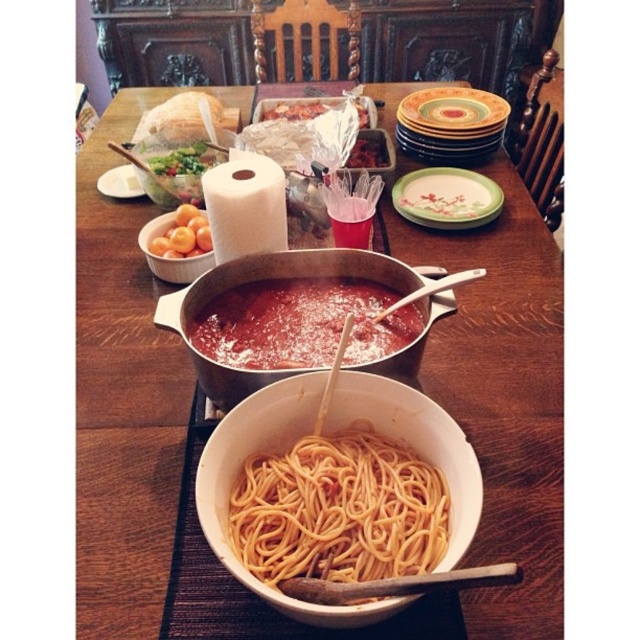
Can you confirm if white ceramic bowl at center is bigger than white matte bowl at center?

Yes, white ceramic bowl at center is bigger than white matte bowl at center.

Image resolution: width=640 pixels, height=640 pixels. Describe the element at coordinates (502, 397) in the screenshot. I see `white ceramic bowl at center` at that location.

This screenshot has width=640, height=640. I want to click on white ceramic bowl at center, so click(x=502, y=397).

Measure the distance between white matte bowl at center and smooth white bread at upper center.

A distance of 33.33 inches exists between white matte bowl at center and smooth white bread at upper center.

This screenshot has width=640, height=640. Find the location of `white matte bowl at center`. white matte bowl at center is located at coordinates (237, 476).

Which is behind, point (481, 477) or point (316, 112)?

The point (316, 112) is behind.

This screenshot has width=640, height=640. In order to click on white matte bowl at center in this screenshot , I will do `click(237, 476)`.

Does point (332, 618) lie behind point (342, 266)?

No, it is not.

Does white matte bowl at center have a lesser height compared to matte ceramic pot at center?

Yes, white matte bowl at center is shorter than matte ceramic pot at center.

Is point (296, 424) positioned after point (412, 349)?

No, (296, 424) is in front of (412, 349).

Find the location of a particular element. Image resolution: width=640 pixels, height=640 pixels. white matte bowl at center is located at coordinates (237, 476).